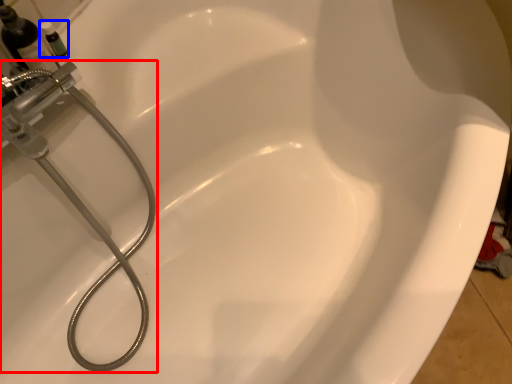
Question: Which object appears closest to the camera in this image, plumbing fixture (highlighted by a red box) or toiletry (highlighted by a blue box)?

Choices:
 (A) plumbing fixture
 (B) toiletry

Answer: (A)